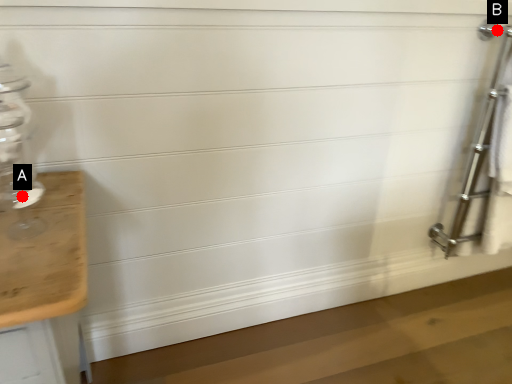
Question: Two points are circled on the image, labeled by A and B beside each circle. Which point is closer to the camera?

Choices:
 (A) A is closer
 (B) B is closer

Answer: (A)